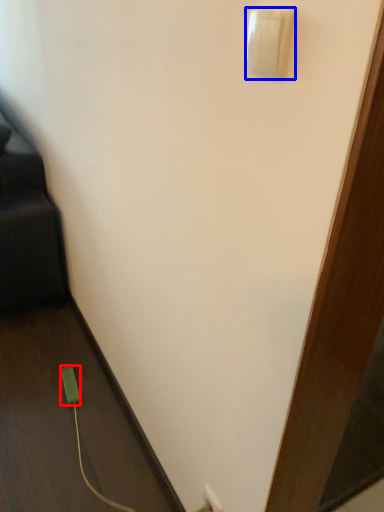
Question: Which object appears farthest to the camera in this image, power plugs and sockets (highlighted by a red box) or light switch (highlighted by a blue box)?

Choices:
 (A) power plugs and sockets
 (B) light switch

Answer: (A)